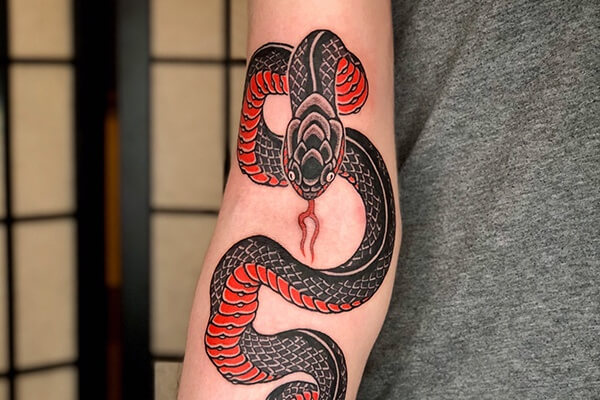
You are a GUI agent. You are given a task and a screenshot of the screen. Output one action in this format:
    pyautogui.click(x=<x>, y=<y>)
    Task: Click on the door
    The image size is (600, 400).
    Given the screenshot: What is the action you would take?
    pyautogui.click(x=142, y=136)